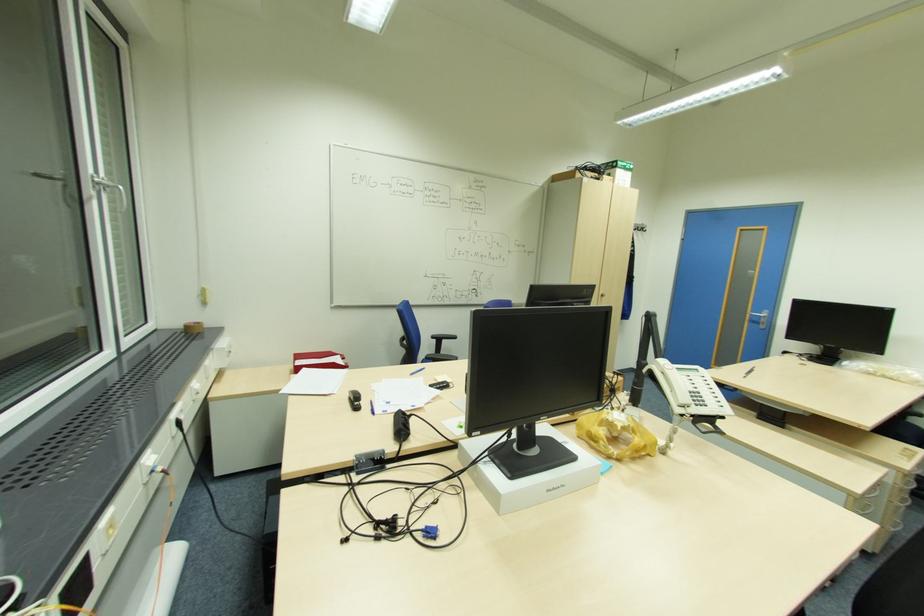
What are the coordinates of `blue chair sitting surface` in the screenshot? It's located at (430, 371).